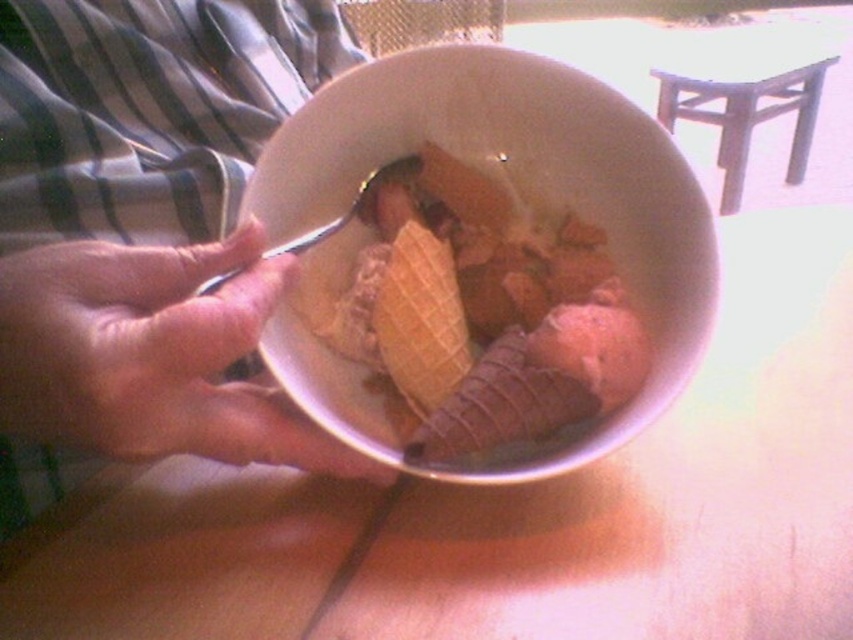
Question: Which of the following is the closest to the observer?

Choices:
 (A) wooden table at center
 (B) white matte bowl at center

Answer: (A)

Question: Observing the image, what is the correct spatial positioning of smooth skin hand at center in reference to waffle cone ice cream at center?

Choices:
 (A) above
 (B) below

Answer: (B)

Question: Can you confirm if smooth skin hand at center is wider than wooden stool at upper center?

Choices:
 (A) yes
 (B) no

Answer: (B)

Question: Estimate the real-world distances between objects in this image. Which object is farther from the waffle cone ice cream at center?

Choices:
 (A) wooden table at center
 (B) smooth skin hand at center
 (C) wooden stool at upper center

Answer: (C)

Question: Among these objects, which one is farthest from the camera?

Choices:
 (A) wooden table at center
 (B) waffle cone ice cream at center
 (C) white matte bowl at center
 (D) smooth skin hand at center

Answer: (B)

Question: Is wooden stool at upper center to the left of waffle cone ice cream at center from the viewer's perspective?

Choices:
 (A) no
 (B) yes

Answer: (A)